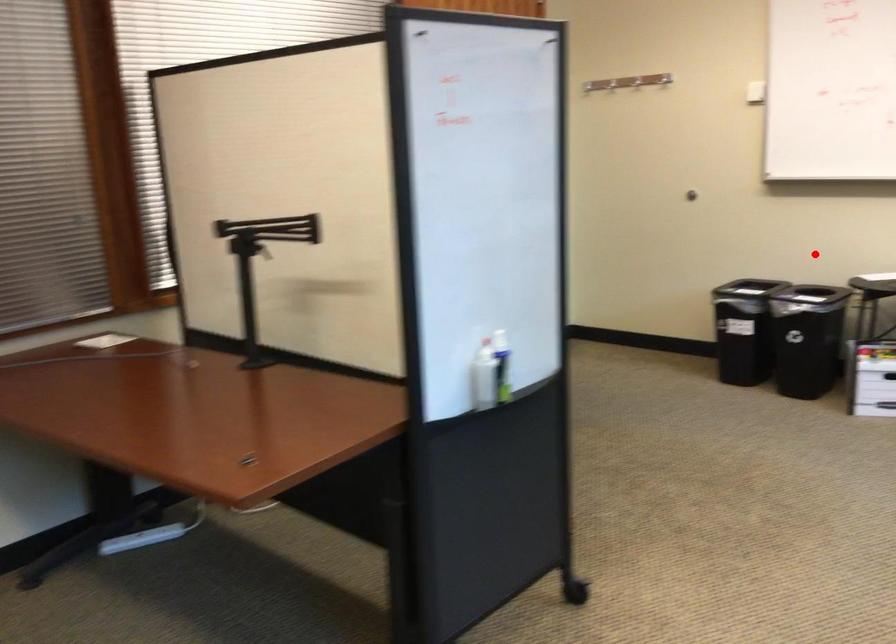
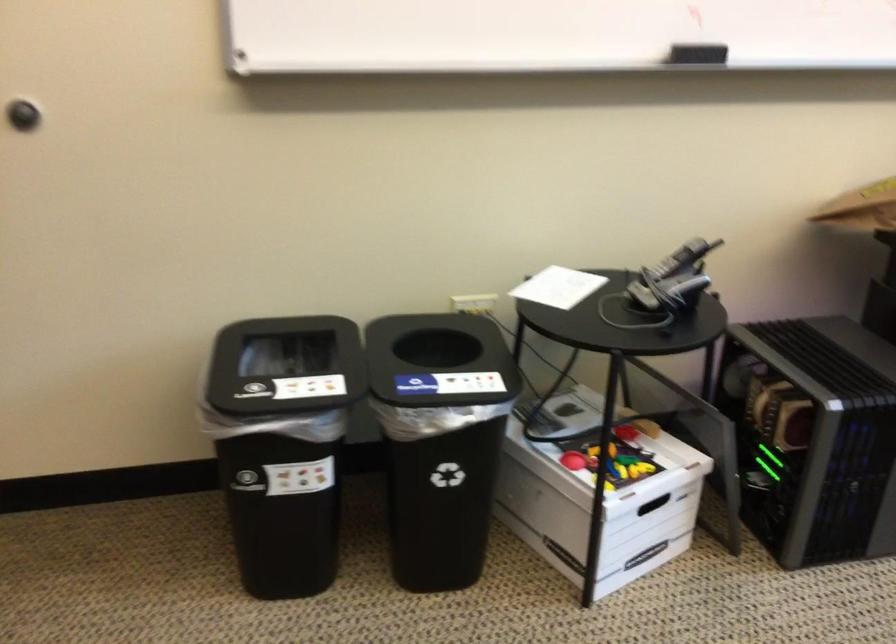
Question: I am providing you with two images of the same scene from different viewpoints. Given a red point in image1, look at the same physical point in image2. Is it:

Choices:
 (A) Closer to the viewpoint
 (B) Farther from the viewpoint

Answer: (A)